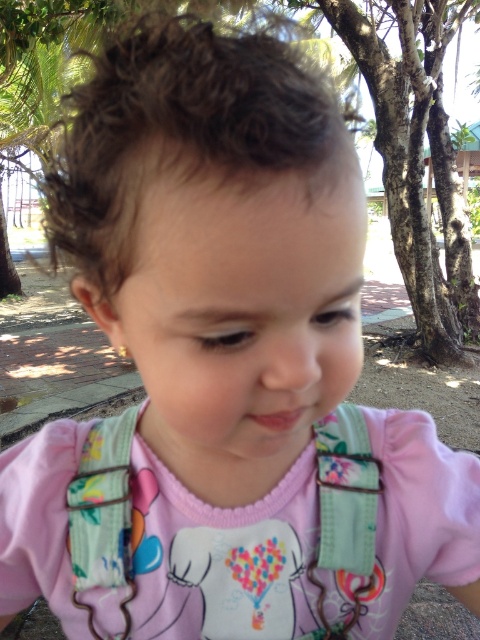
The child in the image is looking down. If the child wants to look at the floral fabric bib at center and the smooth skin face at center, which one would they need to look to their right?

The child would need to look to their right to see the floral fabric bib at center because it is positioned to the right of the smooth skin face at center.

You are a photographer trying to capture the child in the image. The floral fabric bib at center and smooth skin face at center are both in focus. Which object is wider when viewed from your camera lens?

The floral fabric bib at center is wider than the smooth skin face at center, so the photographer will see the floral fabric bib at center as wider in the photo.

You are a photographer trying to capture a closeup of the child. You notice two points in the image labeled as point 1 at coordinates point (38, 516) and point 2 at coordinates point (183, 212). Which point is closer to the camera?

Point 1 at coordinates point (38, 516) is closer to the camera than point 2 at coordinates point (183, 212) because it is further to the viewer.